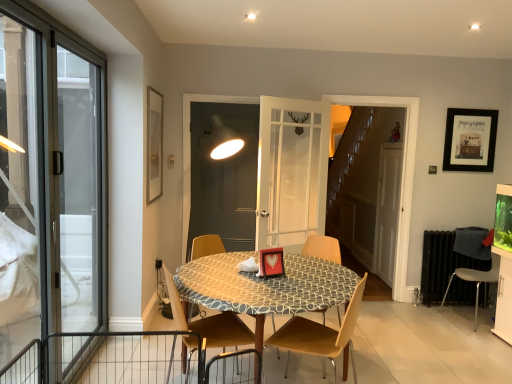
Where is `vacant space that is to the left of wooden chair at center, the second chair in the left-to-right sequence`? The width and height of the screenshot is (512, 384). vacant space that is to the left of wooden chair at center, the second chair in the left-to-right sequence is located at coordinates (153, 357).